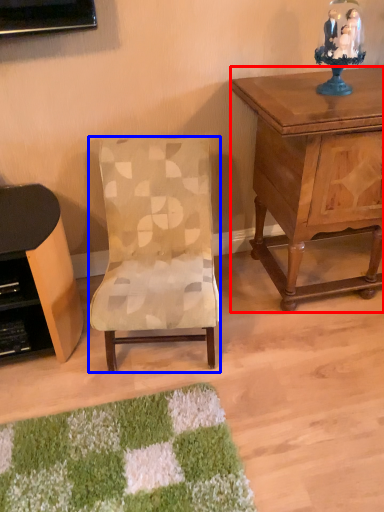
Question: Which object appears closest to the camera in this image, nightstand (highlighted by a red box) or chair (highlighted by a blue box)?

Choices:
 (A) nightstand
 (B) chair

Answer: (B)